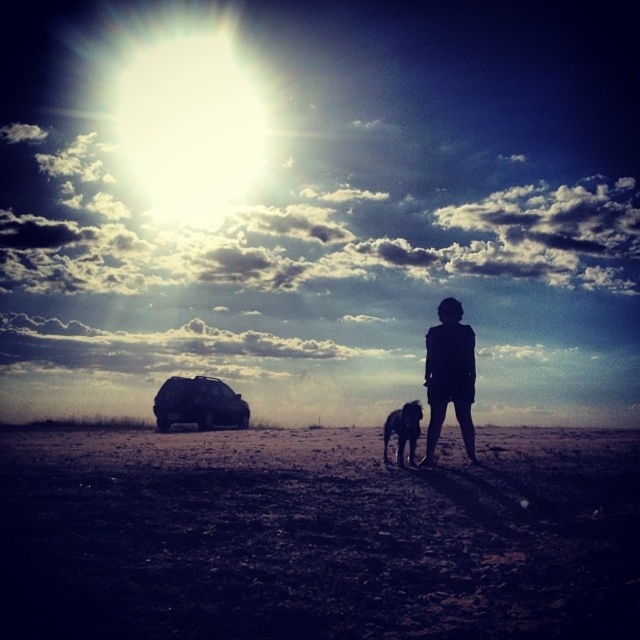
Which of these two, silhouette figure at center or shiny black dog at center, stands taller?

silhouette figure at center is taller.

Locate an element on the screen. silhouette figure at center is located at coordinates (449, 376).

Find the location of a particular element. silhouette figure at center is located at coordinates (449, 376).

Is dark brown dirt field at center above silhouette figure at center?

Actually, dark brown dirt field at center is below silhouette figure at center.

Between dark brown dirt field at center and silhouette figure at center, which one appears on the left side from the viewer's perspective?

dark brown dirt field at center

The height and width of the screenshot is (640, 640). Identify the location of dark brown dirt field at center. (316, 538).

Is black matte suv at lower left behind shiny black dog at center?

Yes, it is behind shiny black dog at center.

Is black matte suv at lower left to the right of shiny black dog at center from the viewer's perspective?

No, black matte suv at lower left is not to the right of shiny black dog at center.

Who is more distant from viewer, (180, 385) or (403, 438)?

The point (180, 385) is behind.

Image resolution: width=640 pixels, height=640 pixels. Identify the location of black matte suv at lower left. (198, 403).